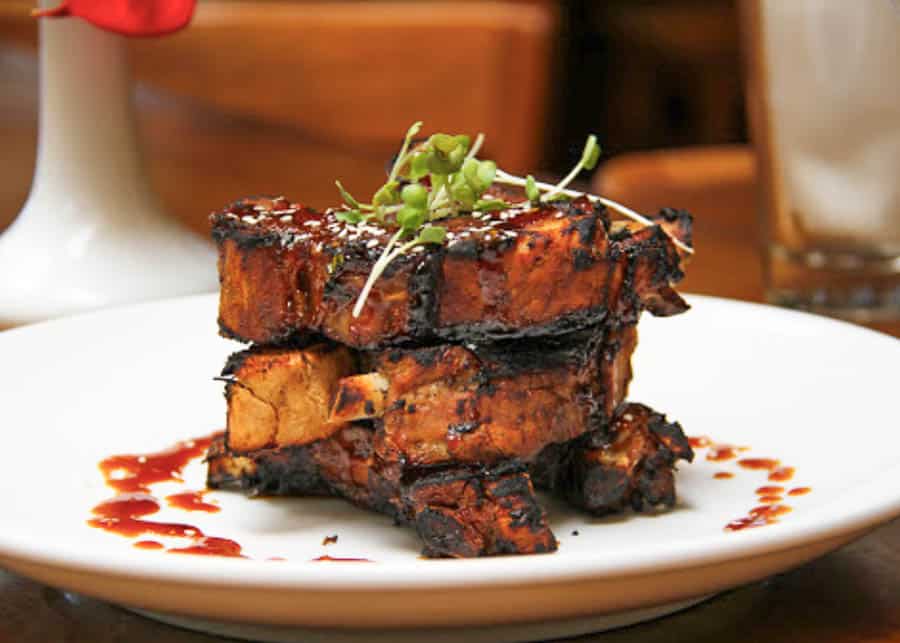
Image resolution: width=900 pixels, height=643 pixels. Find the location of `vase`. vase is located at coordinates (79, 103).